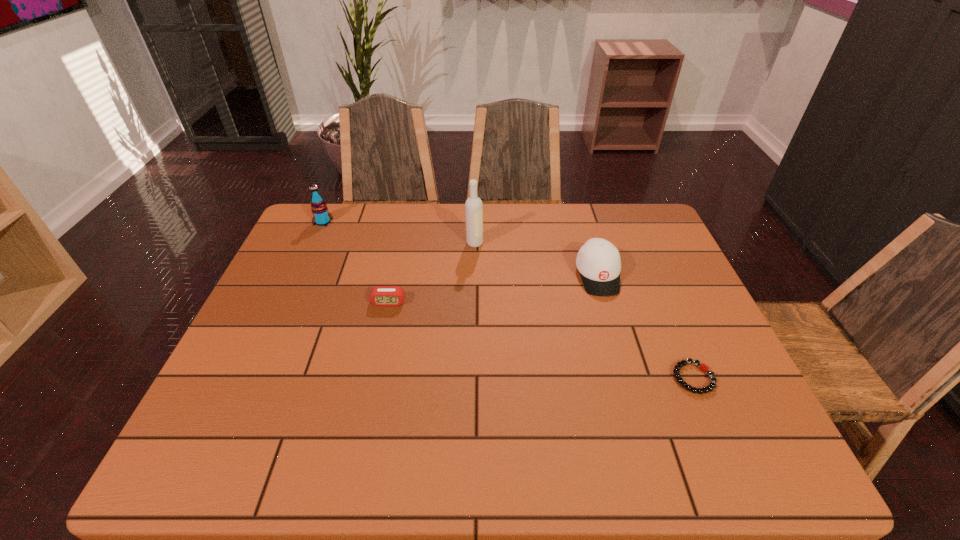
You are a GUI agent. You are given a task and a screenshot of the screen. Output one action in this format:
    pyautogui.click(x=<x>, y=<y>)
    Task: Click on the second farthest object
    
    Given the screenshot: What is the action you would take?
    pyautogui.click(x=473, y=206)

You are a GUI agent. You are given a task and a screenshot of the screen. Output one action in this format:
    pyautogui.click(x=<x>, y=<y>)
    Task: Click on the vodka
    The width and height of the screenshot is (960, 540).
    Given the screenshot: What is the action you would take?
    pyautogui.click(x=473, y=206)

Where is `soda`? The image size is (960, 540). soda is located at coordinates (322, 217).

Identify the location of the leftmost object. The image size is (960, 540). (322, 217).

Image resolution: width=960 pixels, height=540 pixels. Find the location of `the third shortest object`. the third shortest object is located at coordinates (598, 260).

Image resolution: width=960 pixels, height=540 pixels. Identify the location of baseball cap. (598, 260).

Identify the location of alarm clock. (380, 295).

At what (x,y) coordinates should I click in order to perform the action: click on the fourth tallest object. Please return your answer as a coordinate pair (x, y). Looking at the image, I should click on (380, 295).

The height and width of the screenshot is (540, 960). Find the location of `bracelet`. bracelet is located at coordinates (703, 367).

At what (x,y) coordinates should I click in order to perform the action: click on the shortest object. Please return your answer as a coordinate pair (x, y). The image size is (960, 540). Looking at the image, I should click on (703, 367).